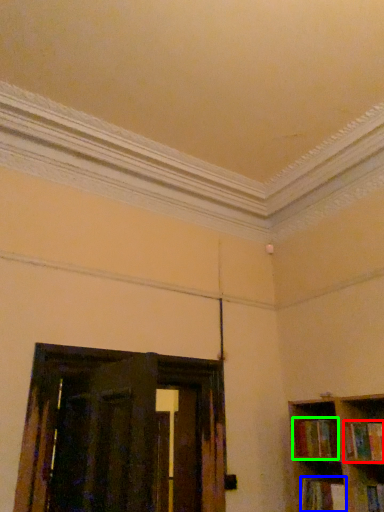
Question: Based on their relative distances, which object is farther from book (highlighted by a red box)? Choose from book (highlighted by a blue box) and book (highlighted by a green box).

Choices:
 (A) book
 (B) book

Answer: (A)